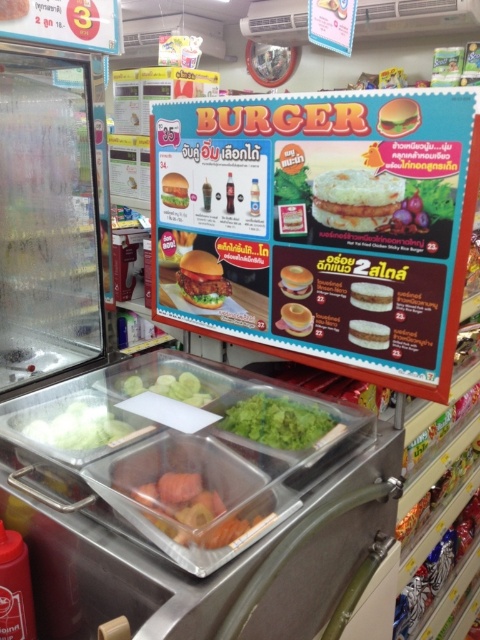
You are standing in front of the burger counter and want to point at two specific points on the menu board. The first point is at coordinates point (212, 490) and the second is at point (199, 381). Which point is closer to you?

Point (212, 490) is closer to the viewer than point (199, 381).

You are a customer at the burger counter and want to know if the translucent plastic tray at center can hold the green matte cucumber at center. Based on their sizes, can it fit?

The translucent plastic tray at center is much taller than the green matte cucumber at center, so it can hold the green matte cucumber at center without any issues.

You are a customer at the burger counter and want to place your order. You notice there are two items at the center of the menu board. One is a translucent plastic tray and the other is a green matte cucumber. If you want to place a small item on top of the translucent plastic tray at center, will it fit if the item is as wide as the green matte cucumber at center?

The translucent plastic tray at center is narrower than the green matte cucumber at center. Therefore, an item as wide as the cucumber would not fit on the tray since the tray is smaller in width.